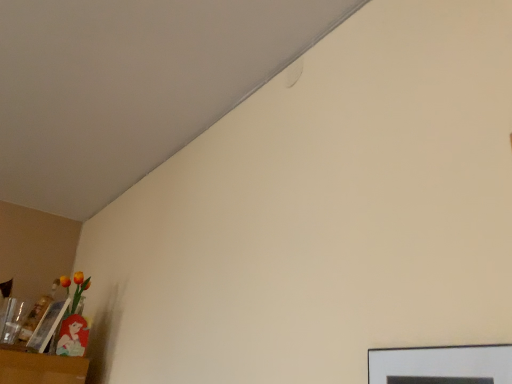
How much space does matte black picture frame at lower right, placed as the 2th picture frame when sorted from bottom to top, occupy horizontally?

1.87 inches.

This screenshot has height=384, width=512. What do you see at coordinates (441, 365) in the screenshot? I see `matte black picture frame at lower right, which appears as the 2th picture frame when viewed from the left` at bounding box center [441, 365].

Measure the distance between matte black picture frame at lower right, which is the first picture frame from front to back, and camera.

matte black picture frame at lower right, which is the first picture frame from front to back, is 56.08 centimeters from camera.

Where is `matte black picture frame at lower right, the 1th picture frame in the top-to-bottom sequence`? matte black picture frame at lower right, the 1th picture frame in the top-to-bottom sequence is located at coordinates (441, 365).

What do you see at coordinates (47, 325) in the screenshot? This screenshot has width=512, height=384. I see `matte plastic picture frame at lower left, which is the 1th picture frame from back to front` at bounding box center [47, 325].

Find the location of `matte plastic picture frame at lower left, which is the 2th picture frame in front-to-back order`. matte plastic picture frame at lower left, which is the 2th picture frame in front-to-back order is located at coordinates (47, 325).

Locate an element on the screen. The width and height of the screenshot is (512, 384). matte black picture frame at lower right, which ranks as the 1th picture frame in right-to-left order is located at coordinates (441, 365).

Which object is positioned more to the left, matte black picture frame at lower right, which appears as the 2th picture frame when viewed from the left, or matte plastic picture frame at lower left, acting as the first picture frame starting from the left?

From the viewer's perspective, matte plastic picture frame at lower left, acting as the first picture frame starting from the left, appears more on the left side.

Which object is more forward, matte black picture frame at lower right, which ranks as the 1th picture frame in right-to-left order, or matte plastic picture frame at lower left, the first picture frame when ordered from bottom to top?

matte black picture frame at lower right, which ranks as the 1th picture frame in right-to-left order, is more forward.

Which is nearer, (x=444, y=348) or (x=38, y=346)?

The point (x=444, y=348) is in front.

From the image's perspective, which one is positioned lower, matte black picture frame at lower right, placed as the 2th picture frame when sorted from bottom to top, or matte plastic picture frame at lower left, which is the second picture frame in top-to-bottom order?

matte plastic picture frame at lower left, which is the second picture frame in top-to-bottom order, from the image's perspective.

Consider the image. From a real-world perspective, is matte black picture frame at lower right, which is the first picture frame from front to back, below matte plastic picture frame at lower left, which appears as the second picture frame when viewed from the right?

Yes, from a real-world perspective, matte black picture frame at lower right, which is the first picture frame from front to back, is beneath matte plastic picture frame at lower left, which appears as the second picture frame when viewed from the right.

Between matte black picture frame at lower right, the 1th picture frame in the top-to-bottom sequence, and matte plastic picture frame at lower left, which is the 1th picture frame from back to front, which one has larger width?

matte plastic picture frame at lower left, which is the 1th picture frame from back to front, is wider.

Considering the relative sizes of matte black picture frame at lower right, which appears as the 2th picture frame when viewed from the left, and matte plastic picture frame at lower left, which appears as the second picture frame when viewed from the right, in the image provided, is matte black picture frame at lower right, which appears as the 2th picture frame when viewed from the left, taller than matte plastic picture frame at lower left, which appears as the second picture frame when viewed from the right,?

No, matte black picture frame at lower right, which appears as the 2th picture frame when viewed from the left, is not taller than matte plastic picture frame at lower left, which appears as the second picture frame when viewed from the right.

Does matte black picture frame at lower right, placed as the 2th picture frame when sorted from bottom to top, have a smaller size compared to matte plastic picture frame at lower left, acting as the first picture frame starting from the left?

Yes, matte black picture frame at lower right, placed as the 2th picture frame when sorted from bottom to top, is smaller than matte plastic picture frame at lower left, acting as the first picture frame starting from the left.

Would you say matte black picture frame at lower right, which ranks as the 1th picture frame in right-to-left order, contains matte plastic picture frame at lower left, which appears as the second picture frame when viewed from the right?

No, matte plastic picture frame at lower left, which appears as the second picture frame when viewed from the right, is not a part of matte black picture frame at lower right, which ranks as the 1th picture frame in right-to-left order.

Is there a large distance between matte black picture frame at lower right, which ranks as the 1th picture frame in right-to-left order, and matte plastic picture frame at lower left, which is the 2th picture frame in front-to-back order?

matte black picture frame at lower right, which ranks as the 1th picture frame in right-to-left order, is far away from matte plastic picture frame at lower left, which is the 2th picture frame in front-to-back order.

Does matte black picture frame at lower right, marked as the second picture frame in a back-to-front arrangement, turn towards matte plastic picture frame at lower left, which is the second picture frame in top-to-bottom order?

No, matte black picture frame at lower right, marked as the second picture frame in a back-to-front arrangement, is not aimed at matte plastic picture frame at lower left, which is the second picture frame in top-to-bottom order.

Measure the distance between matte black picture frame at lower right, marked as the second picture frame in a back-to-front arrangement, and matte plastic picture frame at lower left, which is the second picture frame in top-to-bottom order.

matte black picture frame at lower right, marked as the second picture frame in a back-to-front arrangement, and matte plastic picture frame at lower left, which is the second picture frame in top-to-bottom order, are 5.35 feet apart.

Where is `picture frame behind the matte black picture frame at lower right, which is the first picture frame from front to back`? This screenshot has width=512, height=384. picture frame behind the matte black picture frame at lower right, which is the first picture frame from front to back is located at coordinates (47, 325).

Is matte plastic picture frame at lower left, which is the 2th picture frame in front-to-back order, to the right of matte black picture frame at lower right, marked as the second picture frame in a back-to-front arrangement, from the viewer's perspective?

No.

Is matte plastic picture frame at lower left, which is the second picture frame in top-to-bottom order, behind matte black picture frame at lower right, the 1th picture frame in the top-to-bottom sequence?

Yes, the depth of matte plastic picture frame at lower left, which is the second picture frame in top-to-bottom order, is greater than that of matte black picture frame at lower right, the 1th picture frame in the top-to-bottom sequence.

Which is less distant, (49, 317) or (376, 354)?

Point (49, 317) is positioned farther from the camera compared to point (376, 354).

From the image's perspective, is matte plastic picture frame at lower left, which appears as the second picture frame when viewed from the right, located above or below matte black picture frame at lower right, which is the first picture frame from front to back?

matte plastic picture frame at lower left, which appears as the second picture frame when viewed from the right, is below matte black picture frame at lower right, which is the first picture frame from front to back.

From a real-world perspective, which object rests below the other?

From a 3D spatial view, matte black picture frame at lower right, which ranks as the 1th picture frame in right-to-left order, is below.

Is matte plastic picture frame at lower left, which appears as the second picture frame when viewed from the right, wider or thinner than matte black picture frame at lower right, placed as the 2th picture frame when sorted from bottom to top?

In the image, matte plastic picture frame at lower left, which appears as the second picture frame when viewed from the right, appears to be wider than matte black picture frame at lower right, placed as the 2th picture frame when sorted from bottom to top.

Can you confirm if matte plastic picture frame at lower left, which is the 2th picture frame in front-to-back order, is taller than matte black picture frame at lower right, placed as the 2th picture frame when sorted from bottom to top?

Yes, matte plastic picture frame at lower left, which is the 2th picture frame in front-to-back order, is taller than matte black picture frame at lower right, placed as the 2th picture frame when sorted from bottom to top.

Considering the sizes of objects matte plastic picture frame at lower left, which is the 1th picture frame from back to front, and matte black picture frame at lower right, which is the first picture frame from front to back, in the image provided, who is smaller, matte plastic picture frame at lower left, which is the 1th picture frame from back to front, or matte black picture frame at lower right, which is the first picture frame from front to back,?

Smaller between the two is matte black picture frame at lower right, which is the first picture frame from front to back.

Is matte black picture frame at lower right, which ranks as the 1th picture frame in right-to-left order, completely or partially inside matte plastic picture frame at lower left, the first picture frame when ordered from bottom to top?

No, matte black picture frame at lower right, which ranks as the 1th picture frame in right-to-left order, is not inside matte plastic picture frame at lower left, the first picture frame when ordered from bottom to top.

Are matte plastic picture frame at lower left, which is the second picture frame in top-to-bottom order, and matte black picture frame at lower right, marked as the second picture frame in a back-to-front arrangement, located far from each other?

matte plastic picture frame at lower left, which is the second picture frame in top-to-bottom order, is far away from matte black picture frame at lower right, marked as the second picture frame in a back-to-front arrangement.

Is matte plastic picture frame at lower left, which is the second picture frame in top-to-bottom order, oriented away from matte black picture frame at lower right, placed as the 2th picture frame when sorted from bottom to top?

No, matte black picture frame at lower right, placed as the 2th picture frame when sorted from bottom to top, is not at the back of matte plastic picture frame at lower left, which is the second picture frame in top-to-bottom order.

Locate an element on the screen. The height and width of the screenshot is (384, 512). picture frame that appears below the matte plastic picture frame at lower left, which is the 1th picture frame from back to front (from a real-world perspective) is located at coordinates (441, 365).

Identify the location of picture frame located on the left of matte black picture frame at lower right, marked as the second picture frame in a back-to-front arrangement. (47, 325).

At what (x,y) coordinates should I click in order to perform the action: click on picture frame that appears below the matte black picture frame at lower right, the 1th picture frame in the top-to-bottom sequence (from the image's perspective). Please return your answer as a coordinate pair (x, y). This screenshot has width=512, height=384. Looking at the image, I should click on (47, 325).